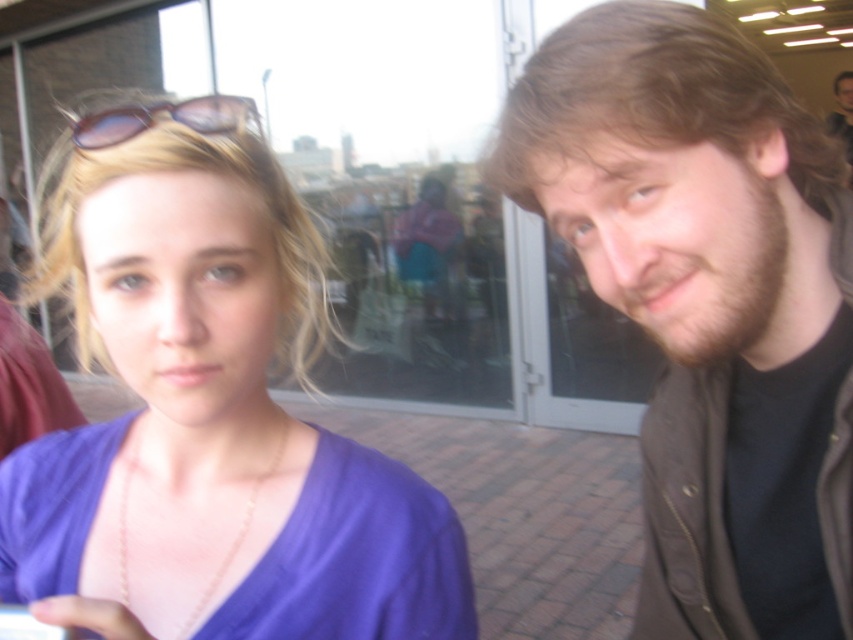
Is purple matte shirt at left to the right of brown hair at right from the viewer's perspective?

In fact, purple matte shirt at left is to the left of brown hair at right.

I want to click on purple matte shirt at left, so coord(207,412).

The image size is (853, 640). I want to click on purple matte shirt at left, so click(x=207, y=412).

Is point (700, 321) positioned before point (839, 108)?

Yes, it is.

Is brown hair at right shorter than brown hair at upper right?

Correct, brown hair at right is not as tall as brown hair at upper right.

Is point (645, 618) behind point (851, 136)?

No.

This screenshot has width=853, height=640. I want to click on brown hair at right, so click(706, 301).

Can you confirm if purple matte shirt at left is positioned above brown hair at upper right?

No, purple matte shirt at left is not above brown hair at upper right.

Does purple matte shirt at left have a larger size compared to brown hair at upper right?

Answer: No.

Where is `purple matte shirt at left`? The width and height of the screenshot is (853, 640). purple matte shirt at left is located at coordinates (207, 412).